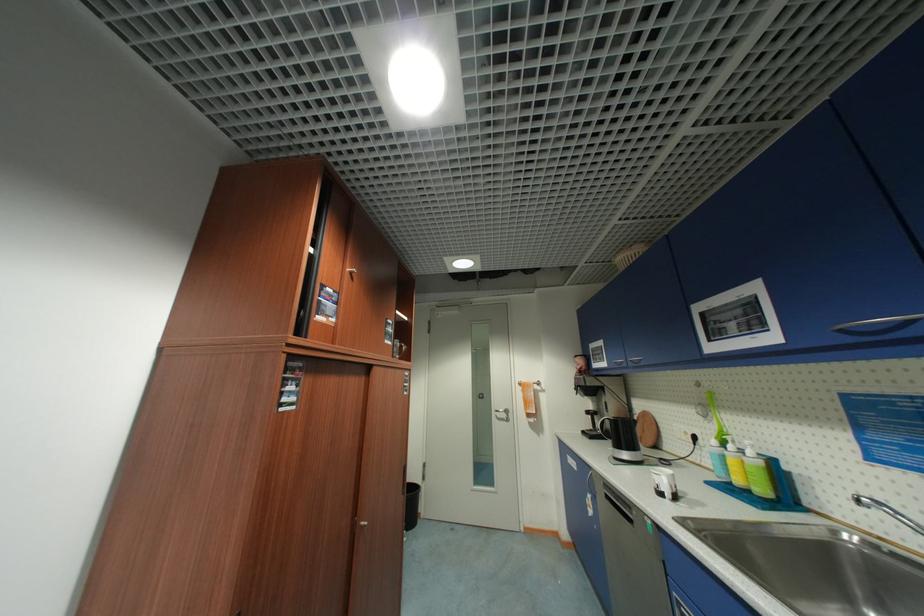
Find where to lift the black kettle handle. Please return your answer as a coordinate pair (x, y).

(603, 428)